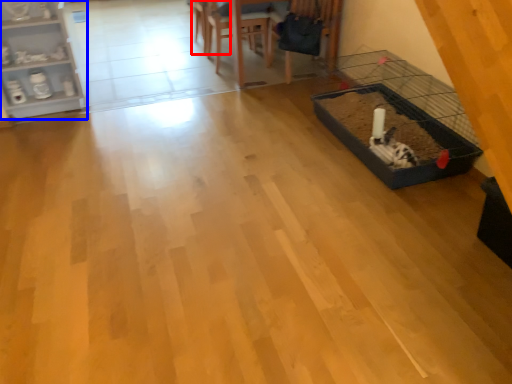
Question: Among these objects, which one is nearest to the camera, armchair (highlighted by a red box) or shelf (highlighted by a blue box)?

Choices:
 (A) armchair
 (B) shelf

Answer: (B)